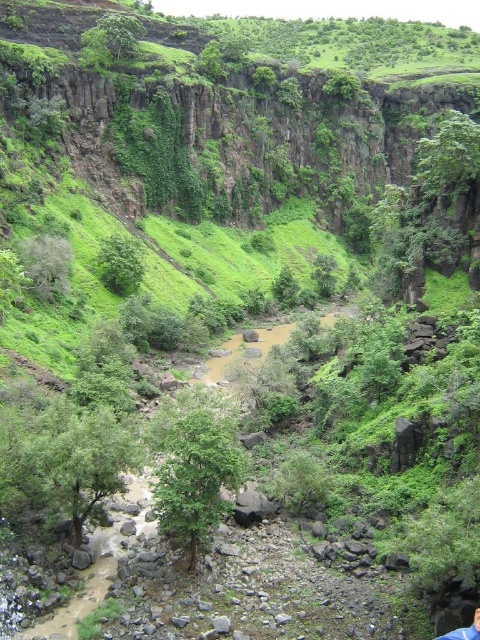
Does green leafy tree at center have a larger size compared to green leafy bush at center?

Yes, green leafy tree at center is bigger than green leafy bush at center.

Measure the distance between point (x=160, y=442) and camera.

46.12 meters

Is point (180, 515) behind point (128, 259)?

No, (180, 515) is closer to viewer.

Identify the location of green leafy tree at center. (193, 464).